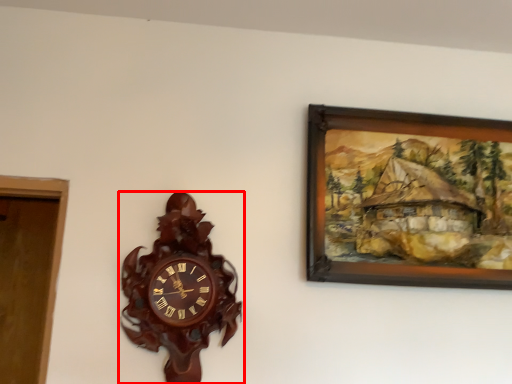
Question: From the image's perspective, what is the correct spatial positioning of wall clock (annotated by the red box) in reference to picture frame?

Choices:
 (A) above
 (B) below

Answer: (B)